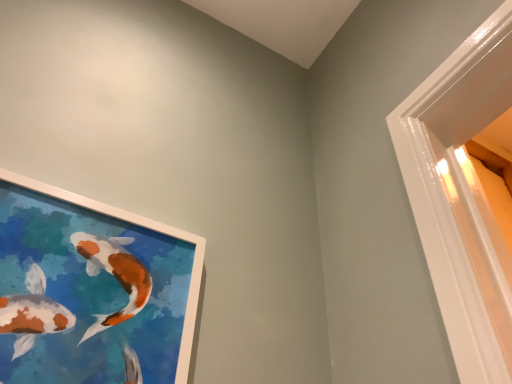
The height and width of the screenshot is (384, 512). What do you see at coordinates (92, 290) in the screenshot?
I see `white matte picture frame at upper left` at bounding box center [92, 290].

Image resolution: width=512 pixels, height=384 pixels. What are the coordinates of `white matte picture frame at upper left` in the screenshot? It's located at (92, 290).

The height and width of the screenshot is (384, 512). I want to click on white matte picture frame at upper left, so click(x=92, y=290).